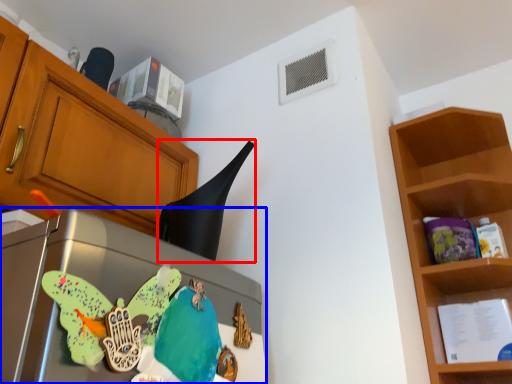
Question: Which object appears farthest to the camera in this image, exhaust hood (highlighted by a red box) or appliance (highlighted by a blue box)?

Choices:
 (A) exhaust hood
 (B) appliance

Answer: (A)